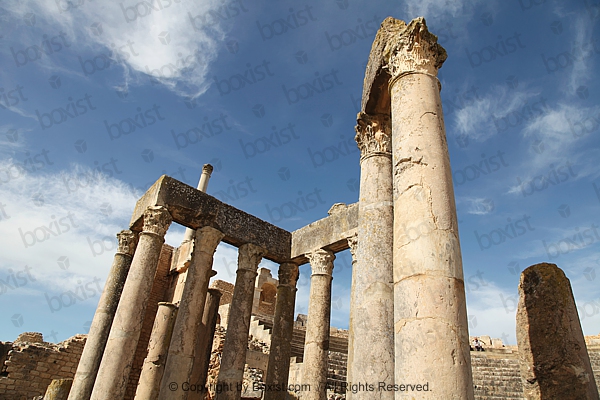
Identify the location of pillar. coord(314,350).